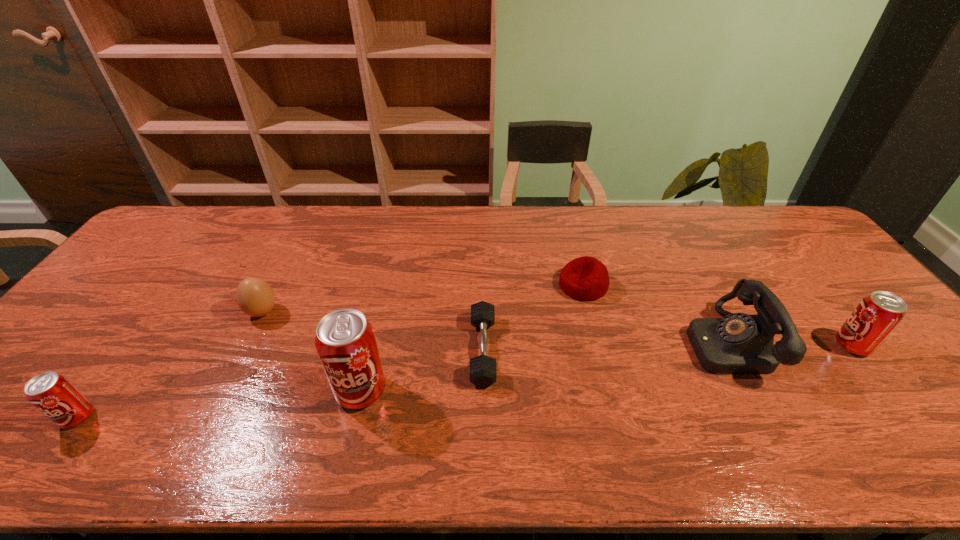
I want to click on free area in between the second object from right to left and the tallest object, so click(x=543, y=367).

The image size is (960, 540). In order to click on vacant region between the boiled egg and the farthest soda in this screenshot , I will do `click(557, 329)`.

This screenshot has width=960, height=540. I want to click on the fifth closest object to the tallest soda, so click(739, 343).

Identify the location of object that stands as the fourth closest to the second object from left to right. (586, 278).

The height and width of the screenshot is (540, 960). Find the location of `the closest soda relative to the beanbag`. the closest soda relative to the beanbag is located at coordinates (345, 341).

Where is `the third closest soda to the dumbbell`? The height and width of the screenshot is (540, 960). the third closest soda to the dumbbell is located at coordinates (877, 315).

Identify the location of free space that satisfies the following two spatial constraints: 1. on the dial of the telephone; 2. on the back side of the rightmost soda. (727, 346).